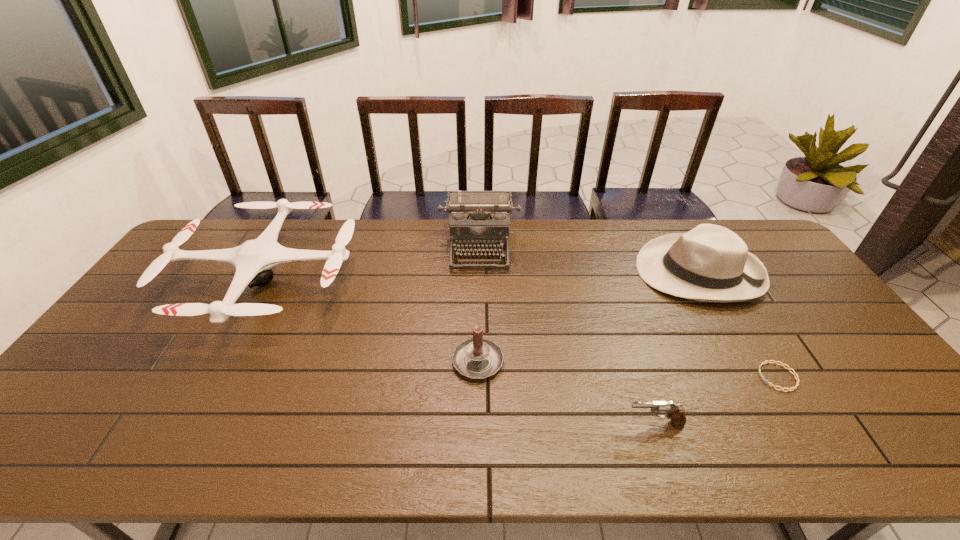
I want to click on vacant position located on the surface of the bracelet showing star-shaped elements, so click(x=607, y=377).

Find the location of a particular element. This screenshot has width=960, height=540. typewriter that is at the far edge is located at coordinates (479, 221).

The width and height of the screenshot is (960, 540). What are the coordinates of `fedora that is at the far edge` in the screenshot? It's located at (710, 263).

What are the coordinates of `drone located at the far edge` in the screenshot? It's located at (253, 260).

The image size is (960, 540). What are the coordinates of `object located at the near edge` in the screenshot? It's located at (676, 413).

At what (x,y) coordinates should I click in order to perform the action: click on object at the left edge. Please return your answer as a coordinate pair (x, y). The height and width of the screenshot is (540, 960). Looking at the image, I should click on (253, 260).

This screenshot has width=960, height=540. Identify the location of object situated at the right edge. (710, 263).

This screenshot has height=540, width=960. What are the coordinates of `object present at the far left corner` in the screenshot? It's located at (253, 260).

Locate an element on the screen. Image resolution: width=960 pixels, height=540 pixels. object at the far right corner is located at coordinates point(710,263).

Locate an element on the screen. The width and height of the screenshot is (960, 540). vacant space at the far edge of the desktop is located at coordinates click(x=514, y=221).